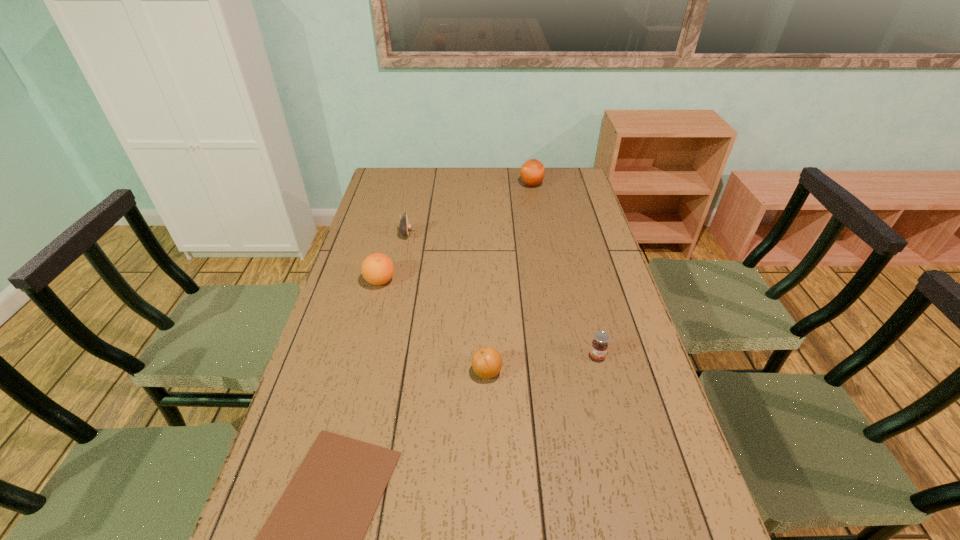
In the image, there is a desktop. Identify the location of blank space at the far left corner. The image size is (960, 540). (385, 171).

The width and height of the screenshot is (960, 540). I want to click on free space that is in between the jam and the avocado, so click(x=502, y=295).

The height and width of the screenshot is (540, 960). In order to click on free spot between the third object from right to left and the avocado in this screenshot , I will do `click(447, 302)`.

Where is `vacant area between the fourth object from left to right and the avocado`? This screenshot has width=960, height=540. vacant area between the fourth object from left to right and the avocado is located at coordinates (447, 302).

Identify the location of vacant area between the second orange from left to right and the fifth nearest object. The height and width of the screenshot is (540, 960). (447, 302).

Where is `free space between the second orange from left to right and the rightmost object`? The width and height of the screenshot is (960, 540). free space between the second orange from left to right and the rightmost object is located at coordinates (541, 364).

Where is `vacant region between the farthest object and the fifth nearest object`? Image resolution: width=960 pixels, height=540 pixels. vacant region between the farthest object and the fifth nearest object is located at coordinates (469, 209).

Find the location of `empty space that is in between the jam and the second orange from left to right`. empty space that is in between the jam and the second orange from left to right is located at coordinates (541, 364).

I want to click on the closest object to the farthest object, so click(405, 227).

Identify which object is the third closest to the farthest orange. Please provide its 2D coordinates. Your answer should be formatted as a tuple, i.e. [(x, y)], where the tuple contains the x and y coordinates of a point satisfying the conditions above.

[(599, 346)]